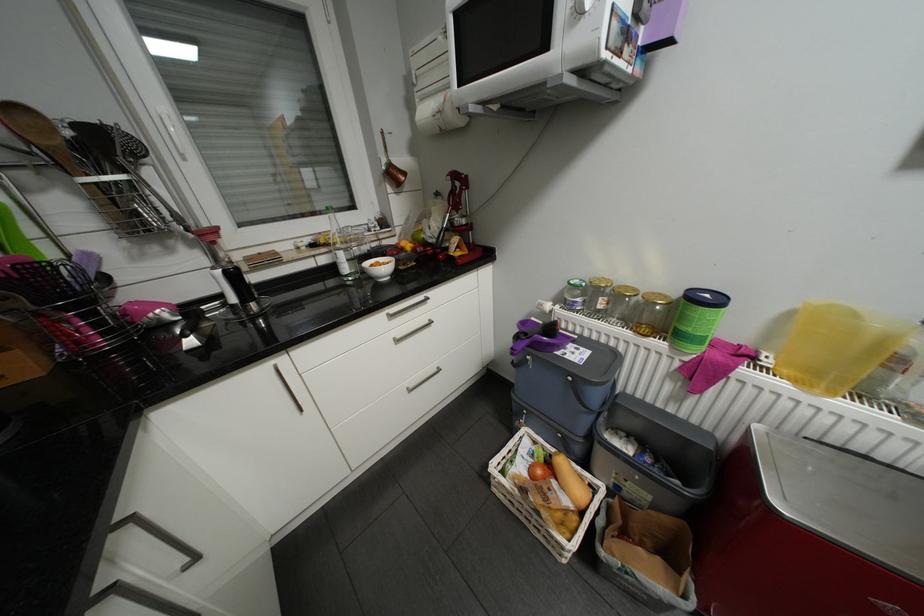
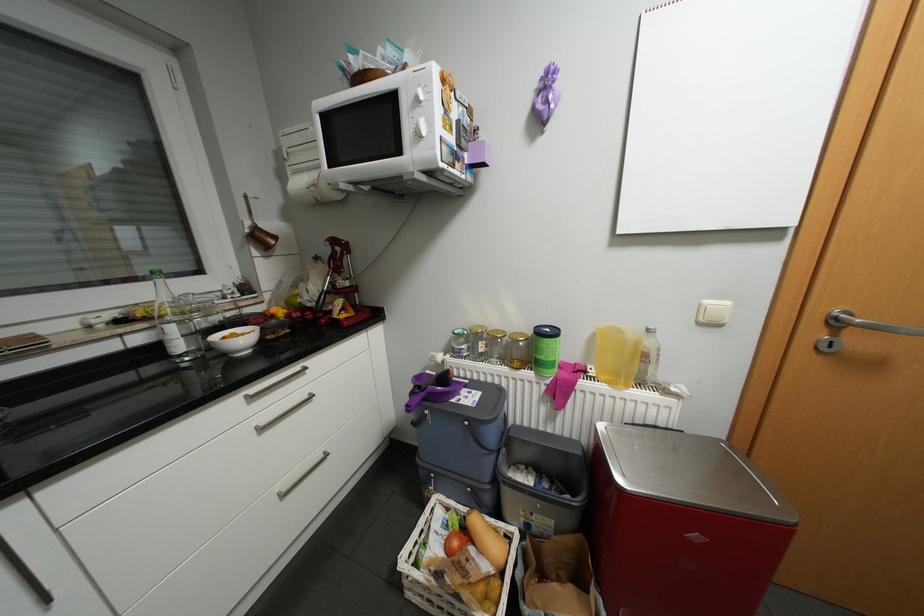
The point at (589, 476) is marked in the first image. Where is the corresponding point in the second image?

(504, 528)